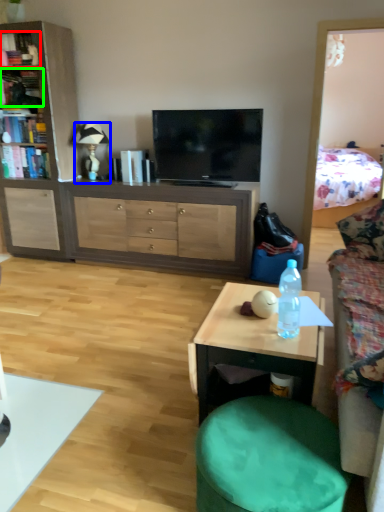
Question: Which object is positioned farthest from book (highlighted by a red box)? Select from lamp (highlighted by a blue box) and book (highlighted by a green box).

Choices:
 (A) lamp
 (B) book

Answer: (A)